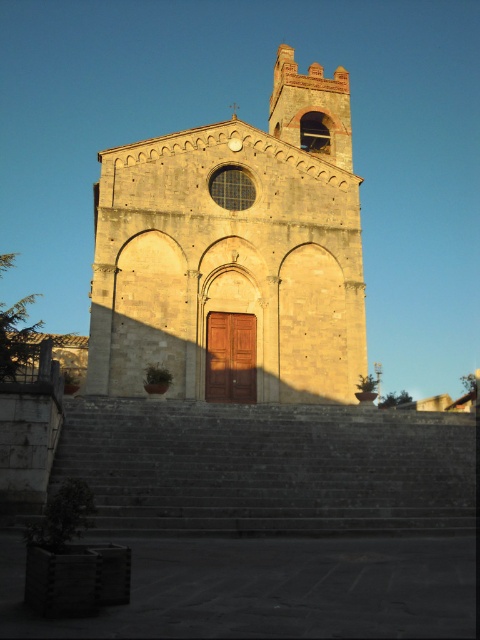
You are standing in front of the historic stone church with a bell tower. There is a point marked at coordinates (235, 253). What does this point indicate?

The point at coordinates (235, 253) marks the golden stone church at center.

You are standing at the bottom of the gray stone stairs at lower center and want to enter the golden stone church at center. Which direction should you walk to reach the entrance?

You should walk towards the golden stone church at center, as the gray stone stairs at lower center are behind it, meaning the church is in front of you.